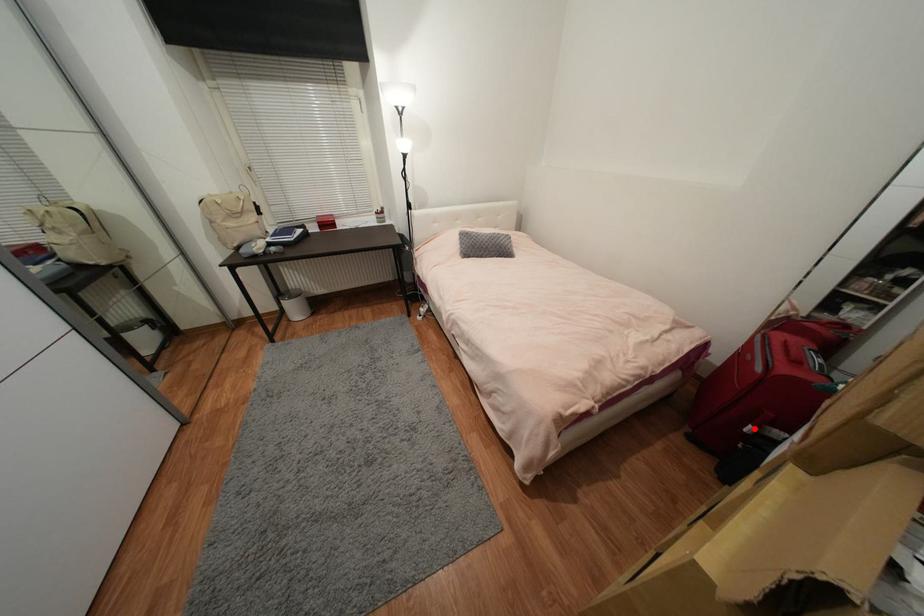
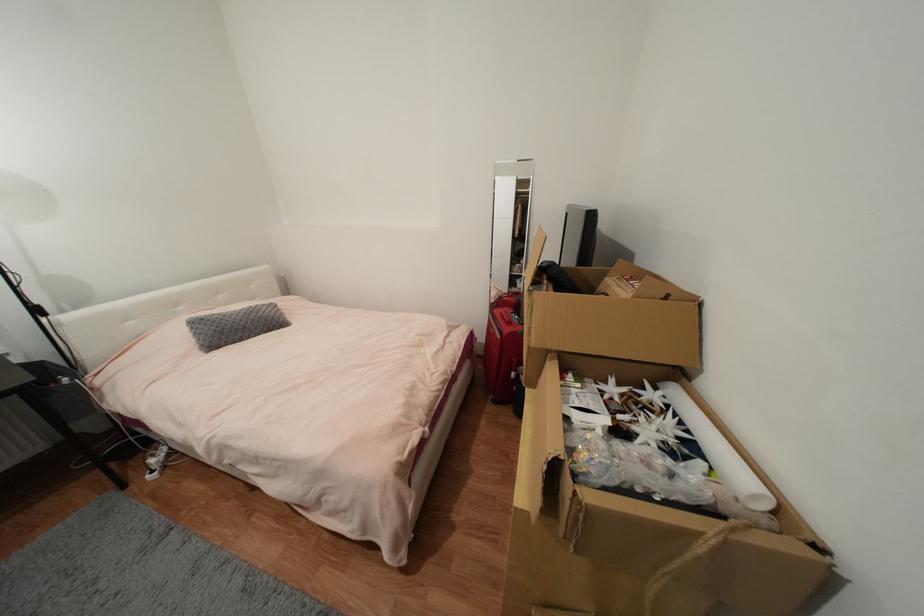
In the second image, find the point that corresponds to the highlighted location in the first image.

(517, 375)